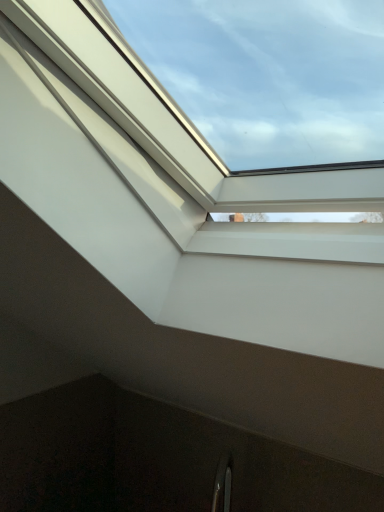
Identify the location of transparent glass window at upper center. This screenshot has height=512, width=384. (178, 123).

Looking at this image, measure the distance between transparent glass window at upper center and camera.

A distance of 20.56 inches exists between transparent glass window at upper center and camera.

What do you see at coordinates (178, 123) in the screenshot? I see `transparent glass window at upper center` at bounding box center [178, 123].

This screenshot has width=384, height=512. Find the location of `transparent glass window at upper center`. transparent glass window at upper center is located at coordinates (178, 123).